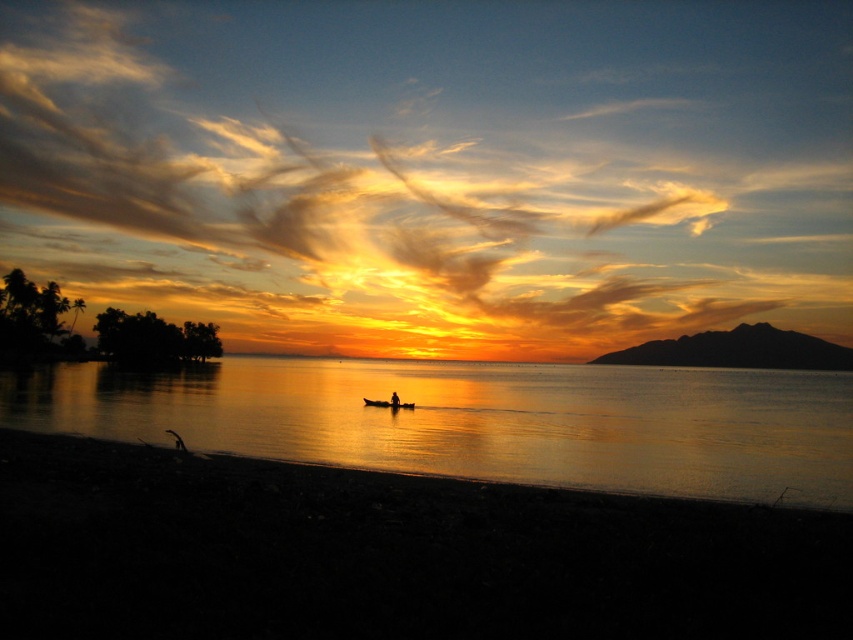
Question: Can you confirm if silky smooth water at center is thinner than silhouette human at center?

Choices:
 (A) yes
 (B) no

Answer: (B)

Question: Does golden cotton clouds at upper center have a larger size compared to silhouette human at center?

Choices:
 (A) yes
 (B) no

Answer: (A)

Question: Estimate the real-world distances between objects in this image. Which object is farther from the silky smooth water at center?

Choices:
 (A) wooden canoe at center
 (B) silhouette human at center

Answer: (A)

Question: Among these objects, which one is nearest to the camera?

Choices:
 (A) silhouette human at center
 (B) wooden canoe at center
 (C) golden cotton clouds at upper center
 (D) silky smooth water at center

Answer: (D)

Question: Which object is farther from the camera taking this photo?

Choices:
 (A) silhouette human at center
 (B) wooden canoe at center
 (C) silky smooth water at center

Answer: (B)

Question: Is silky smooth water at center below silhouette human at center?

Choices:
 (A) no
 (B) yes

Answer: (B)